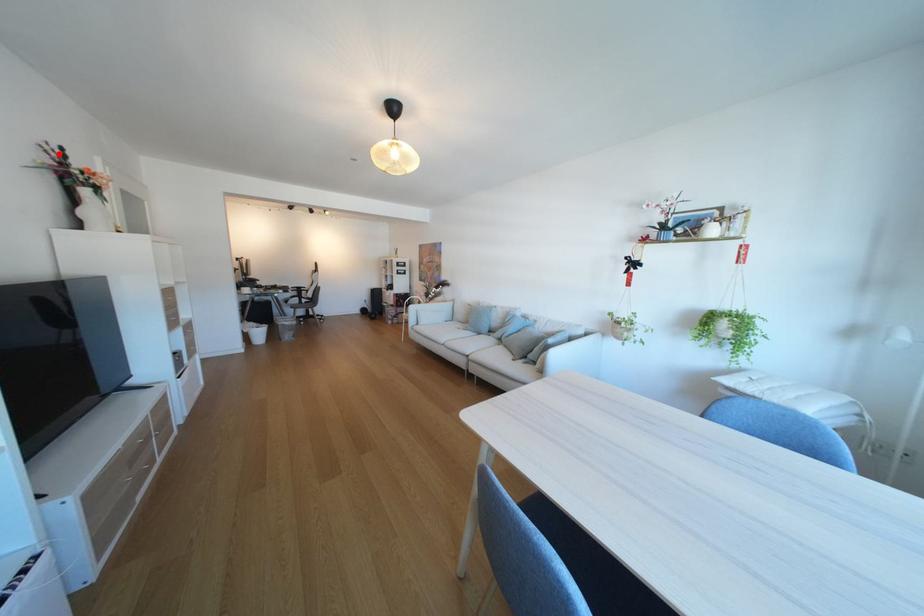
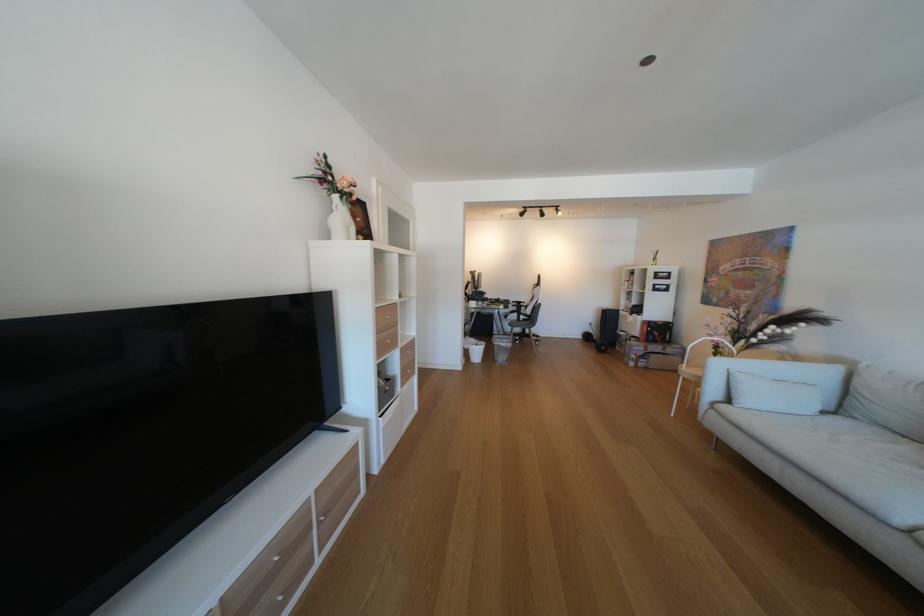
The point at the highlighted location is marked in the first image. Where is the corresponding point in the second image?

(331, 166)